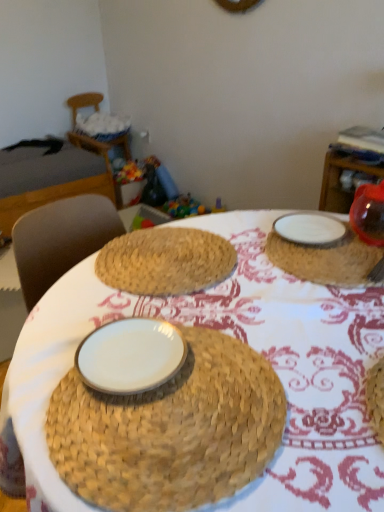
Identify the location of empty space that is ontop of white glossy plate at center, which is counted as the second plate, starting from the top (from a real-world perspective). Image resolution: width=384 pixels, height=512 pixels. (133, 351).